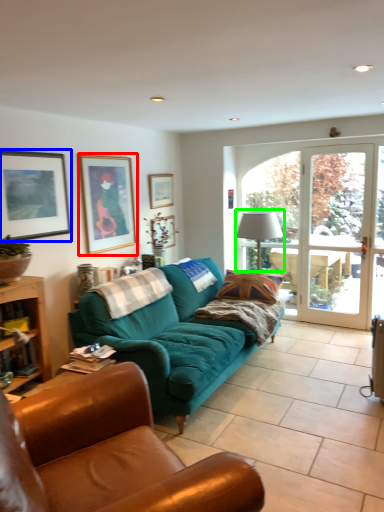
Question: Which object is positioned farthest from picture frame (highlighted by a red box)? Select from picture frame (highlighted by a blue box) and lamp (highlighted by a green box).

Choices:
 (A) picture frame
 (B) lamp

Answer: (B)